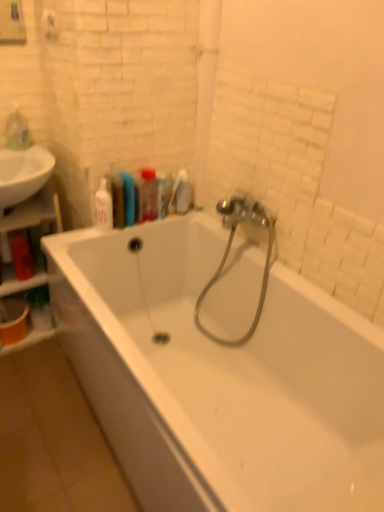
The height and width of the screenshot is (512, 384). What do you see at coordinates (23, 174) in the screenshot? I see `white glossy sink at left` at bounding box center [23, 174].

What do you see at coordinates (17, 131) in the screenshot?
I see `translucent plastic bag at upper left, the fourth toiletry positioned from the right` at bounding box center [17, 131].

Locate an element on the screen. This screenshot has height=512, width=384. translucent plastic bottle at upper center, marked as the third toiletry in a left-to-right arrangement is located at coordinates (148, 195).

Find the location of `white matte towel bar at upper left`. white matte towel bar at upper left is located at coordinates (49, 23).

Does translucent plastic bottle at upper center, marked as the 2th toiletry in a right-to-left arrangement, have a lesser width compared to translucent plastic bag at upper left, marked as the first toiletry in a left-to-right arrangement?

No, translucent plastic bottle at upper center, marked as the 2th toiletry in a right-to-left arrangement, is not thinner than translucent plastic bag at upper left, marked as the first toiletry in a left-to-right arrangement.

Is translucent plastic bottle at upper center, marked as the 2th toiletry in a right-to-left arrangement, far away from translucent plastic bag at upper left, marked as the first toiletry in a left-to-right arrangement?

No, translucent plastic bottle at upper center, marked as the 2th toiletry in a right-to-left arrangement, is in close proximity to translucent plastic bag at upper left, marked as the first toiletry in a left-to-right arrangement.

Is point (140, 181) closer or farther from the camera than point (12, 141)?

Clearly, point (140, 181) is closer to the camera than point (12, 141).

From the image's perspective, is translucent plastic bottle at upper center, marked as the 2th toiletry in a right-to-left arrangement, located above translucent plastic bag at upper left, the fourth toiletry positioned from the right?

Incorrect, from the image's perspective, translucent plastic bottle at upper center, marked as the 2th toiletry in a right-to-left arrangement, is lower than translucent plastic bag at upper left, the fourth toiletry positioned from the right.

Is point (46, 188) positioned behind point (108, 227)?

Yes.

Is wooden shelf at left positioned in front of white glossy soap dispenser at upper left, which is the 3th toiletry from right to left?

Yes, it is in front of white glossy soap dispenser at upper left, which is the 3th toiletry from right to left.

Would you say wooden shelf at left is outside white glossy soap dispenser at upper left, the 2th toiletry from the left?

Yes, wooden shelf at left is not within white glossy soap dispenser at upper left, the 2th toiletry from the left.

In terms of size, does white glossy bathtub at center appear bigger or smaller than translucent plastic toothbrush at upper center, which is the 4th toiletry from left to right?

Clearly, white glossy bathtub at center is larger in size than translucent plastic toothbrush at upper center, which is the 4th toiletry from left to right.

Is white glossy bathtub at center taller than translucent plastic toothbrush at upper center, which is the 4th toiletry from left to right?

Indeed, white glossy bathtub at center has a greater height compared to translucent plastic toothbrush at upper center, which is the 4th toiletry from left to right.

Are white glossy bathtub at center and translucent plastic toothbrush at upper center, placed as the first toiletry when sorted from right to left, far apart?

No, there isn't a large distance between white glossy bathtub at center and translucent plastic toothbrush at upper center, placed as the first toiletry when sorted from right to left.

This screenshot has height=512, width=384. Find the location of `the 1st toiletry above the white glossy bathtub at center (from a real-world perspective)`. the 1st toiletry above the white glossy bathtub at center (from a real-world perspective) is located at coordinates (161, 197).

From the image's perspective, is white glossy soap dispenser at upper left, which is the 3th toiletry from right to left, above or below white glossy sink at left?

Clearly, from the image's perspective, white glossy soap dispenser at upper left, which is the 3th toiletry from right to left, is below white glossy sink at left.

Is there a large distance between white glossy soap dispenser at upper left, which is the 3th toiletry from right to left, and white glossy sink at left?

Actually, white glossy soap dispenser at upper left, which is the 3th toiletry from right to left, and white glossy sink at left are a little close together.

Identify the location of sink above the white glossy soap dispenser at upper left, which is the 3th toiletry from right to left (from a real-world perspective). (23, 174).

Can you confirm if wooden shelf at left is shorter than metallic silver garden hose at center?

No, wooden shelf at left is not shorter than metallic silver garden hose at center.

Find the location of a particular element. The image size is (384, 512). shelf that appears behind the metallic silver garden hose at center is located at coordinates (33, 213).

Can you confirm if wooden shelf at left is positioned to the left of metallic silver garden hose at center?

Yes.

Which point is more distant from viewer, [57,204] or [222,214]?

The point [57,204] is farther.

In the scene shown: Considering the relative positions of translucent plastic toothbrush at upper center, placed as the first toiletry when sorted from right to left, and translucent plastic bottle at upper center, marked as the third toiletry in a left-to-right arrangement, in the image provided, is translucent plastic toothbrush at upper center, placed as the first toiletry when sorted from right to left, to the left of translucent plastic bottle at upper center, marked as the third toiletry in a left-to-right arrangement, from the viewer's perspective?

No, translucent plastic toothbrush at upper center, placed as the first toiletry when sorted from right to left, is not to the left of translucent plastic bottle at upper center, marked as the third toiletry in a left-to-right arrangement.

Is translucent plastic toothbrush at upper center, placed as the first toiletry when sorted from right to left, wider than translucent plastic bottle at upper center, marked as the third toiletry in a left-to-right arrangement?

In fact, translucent plastic toothbrush at upper center, placed as the first toiletry when sorted from right to left, might be narrower than translucent plastic bottle at upper center, marked as the third toiletry in a left-to-right arrangement.

From a real-world perspective, is translucent plastic toothbrush at upper center, which is the 4th toiletry from left to right, on translucent plastic bottle at upper center, marked as the third toiletry in a left-to-right arrangement?

No, from a real-world perspective, translucent plastic toothbrush at upper center, which is the 4th toiletry from left to right, is not above translucent plastic bottle at upper center, marked as the third toiletry in a left-to-right arrangement.

Which point is more distant from viewer, (148,185) or (48,17)?

Point (148,185)

Does translucent plastic bottle at upper center, marked as the third toiletry in a left-to-right arrangement, have a larger size compared to white matte towel bar at upper left?

Yes.

What's the angular difference between translucent plastic bottle at upper center, marked as the 2th toiletry in a right-to-left arrangement, and white matte towel bar at upper left's facing directions?

They differ by 85 degrees in their facing directions.

At what (x,y) coordinates should I click in order to perform the action: click on the 1st toiletry behind the translucent plastic bottle at upper center, marked as the third toiletry in a left-to-right arrangement. Please return your answer as a coordinate pair (x, y). This screenshot has width=384, height=512. Looking at the image, I should click on (17, 131).

Where is `shelf that is on the left side of white glossy soap dispenser at upper left, which is the 3th toiletry from right to left`? shelf that is on the left side of white glossy soap dispenser at upper left, which is the 3th toiletry from right to left is located at coordinates (33, 213).

Considering their positions, is translucent plastic bottle at upper center, marked as the 2th toiletry in a right-to-left arrangement, positioned further to wooden shelf at left than white glossy bathtub at center?

The object further to wooden shelf at left is white glossy bathtub at center.

When comparing their distances from white glossy soap dispenser at upper left, which is the 3th toiletry from right to left, does wooden shelf at left or translucent plastic bag at upper left, the fourth toiletry positioned from the right, seem closer?

Among the two, wooden shelf at left is located nearer to white glossy soap dispenser at upper left, which is the 3th toiletry from right to left.

Estimate the real-world distances between objects in this image. Which object is further from translucent plastic bag at upper left, the fourth toiletry positioned from the right, metallic silver garden hose at center or wooden shelf at left?

metallic silver garden hose at center is positioned further to the anchor translucent plastic bag at upper left, the fourth toiletry positioned from the right.

Considering their positions, is translucent plastic bottle at upper center, marked as the 2th toiletry in a right-to-left arrangement, positioned closer to white glossy sink at left than wooden shelf at left?

Among the two, wooden shelf at left is located nearer to white glossy sink at left.

Looking at the image, which one is located further to metallic silver garden hose at center, wooden shelf at left or white glossy soap dispenser at upper left, which is the 3th toiletry from right to left?

Among the two, wooden shelf at left is located further to metallic silver garden hose at center.

Considering their positions, is wooden shelf at left positioned further to metallic silver garden hose at center than translucent plastic toothbrush at upper center, placed as the first toiletry when sorted from right to left?

Based on the image, wooden shelf at left appears to be further to metallic silver garden hose at center.

Based on their spatial positions, is white glossy bathtub at center or metallic silver garden hose at center closer to white matte towel bar at upper left?

metallic silver garden hose at center.

From the image, which object appears to be nearer to white matte towel bar at upper left, wooden shelf at left or white glossy soap dispenser at upper left, the 2th toiletry from the left?

white glossy soap dispenser at upper left, the 2th toiletry from the left, is positioned closer to the anchor white matte towel bar at upper left.

The width and height of the screenshot is (384, 512). What are the coordinates of `sink between translucent plastic bag at upper left, marked as the first toiletry in a left-to-right arrangement, and translucent plastic toothbrush at upper center, placed as the first toiletry when sorted from right to left, in the horizontal direction` in the screenshot? It's located at (23, 174).

Identify the location of sink between translucent plastic bag at upper left, marked as the first toiletry in a left-to-right arrangement, and translucent plastic bottle at upper center, marked as the third toiletry in a left-to-right arrangement, from left to right. Image resolution: width=384 pixels, height=512 pixels. (23, 174).

Identify the location of garden hose between white matte towel bar at upper left and wooden shelf at left from top to bottom. (229, 250).

Where is `shelf between white glossy bathtub at center and white glossy soap dispenser at upper left, the 2th toiletry from the left, from front to back`? This screenshot has width=384, height=512. shelf between white glossy bathtub at center and white glossy soap dispenser at upper left, the 2th toiletry from the left, from front to back is located at coordinates (33, 213).